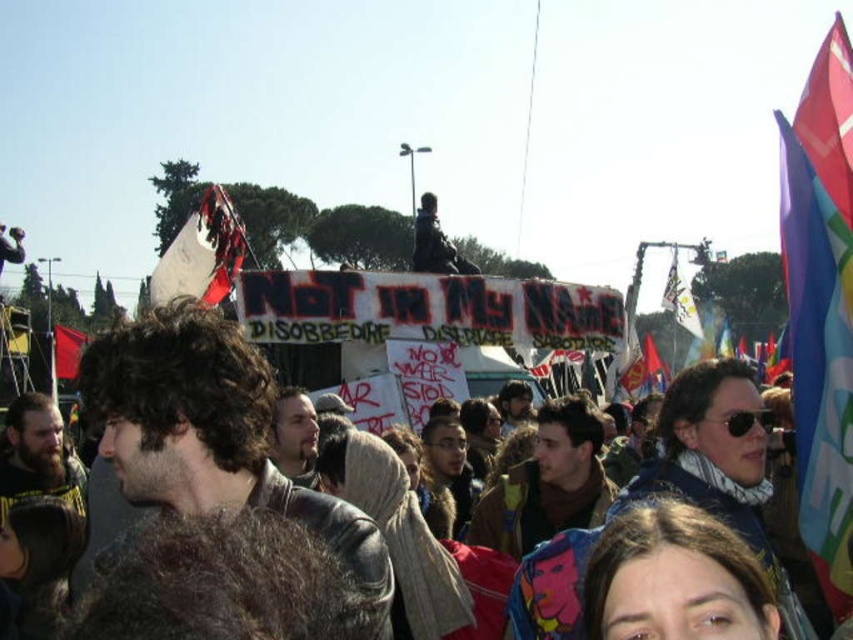
Is the position of brown hair at lower center less distant than that of dark brown hair at center?

Yes, brown hair at lower center is in front of dark brown hair at center.

Who is positioned more to the left, brown hair at lower center or dark brown hair at center?

dark brown hair at center

The image size is (853, 640). What do you see at coordinates (675, 579) in the screenshot?
I see `brown hair at lower center` at bounding box center [675, 579].

Find the location of `brown hair at lower center`. brown hair at lower center is located at coordinates (675, 579).

Which is behind, point (601, 552) or point (231, 212)?

Point (231, 212)

Which is below, brown hair at lower center or rusty metal sign at upper left?

Positioned lower is brown hair at lower center.

Is point (637, 598) farther from camera compared to point (235, 221)?

No, it is in front of (235, 221).

Where is `brown hair at lower center`? The height and width of the screenshot is (640, 853). brown hair at lower center is located at coordinates (675, 579).

Is polyester flag at right taller than red fabric flag at left?

Yes.

Which is below, polyester flag at right or red fabric flag at left?

red fabric flag at left

Where is `polyester flag at right`? This screenshot has width=853, height=640. polyester flag at right is located at coordinates (821, 301).

Locate an element on the screen. This screenshot has height=640, width=853. polyester flag at right is located at coordinates (821, 301).